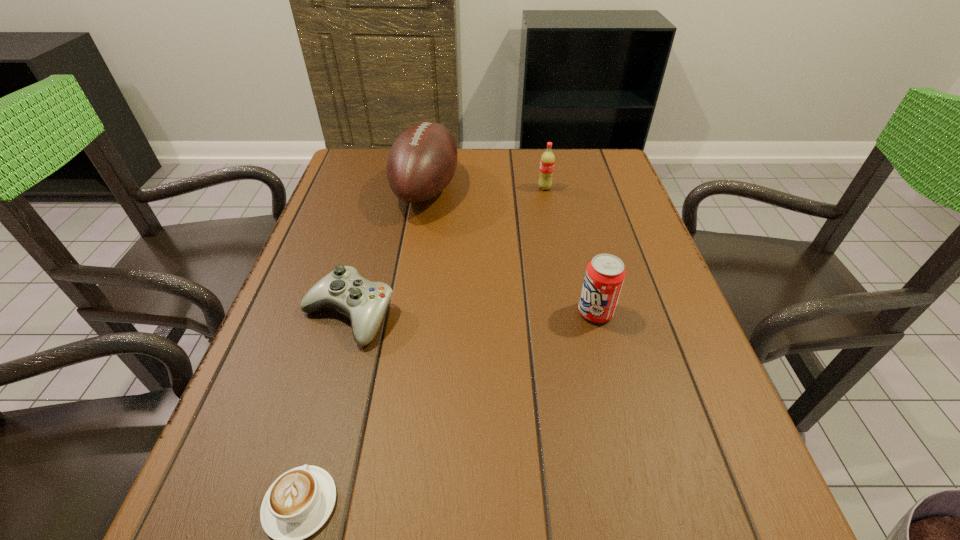
The width and height of the screenshot is (960, 540). What are the coordinates of `football (American) that is at the far edge` in the screenshot? It's located at tap(422, 161).

The image size is (960, 540). In order to click on soda that is at the far edge in this screenshot , I will do `click(547, 161)`.

The height and width of the screenshot is (540, 960). In order to click on object that is positioned at the left edge in this screenshot , I will do `click(364, 302)`.

Locate an element on the screen. object present at the right edge is located at coordinates (605, 274).

In the image, there is a desktop. Where is `vacant region at the far edge`? Image resolution: width=960 pixels, height=540 pixels. vacant region at the far edge is located at coordinates (464, 150).

Where is `free space at the left edge of the desktop`? free space at the left edge of the desktop is located at coordinates (290, 286).

Where is `blank space at the right edge of the desktop`? blank space at the right edge of the desktop is located at coordinates (643, 315).

Find the location of a particular element. This screenshot has width=960, height=540. vacant area at the far left corner is located at coordinates (380, 172).

In the image, there is a desktop. At what (x,y) coordinates should I click in order to perform the action: click on free region at the far right corner. Please return your answer as a coordinate pair (x, y). The height and width of the screenshot is (540, 960). Looking at the image, I should click on (590, 152).

At what (x,y) coordinates should I click in order to perform the action: click on vacant point located between the nearer soda can and the farther soda can. Please return your answer as a coordinate pair (x, y). Image resolution: width=960 pixels, height=540 pixels. Looking at the image, I should click on (570, 250).